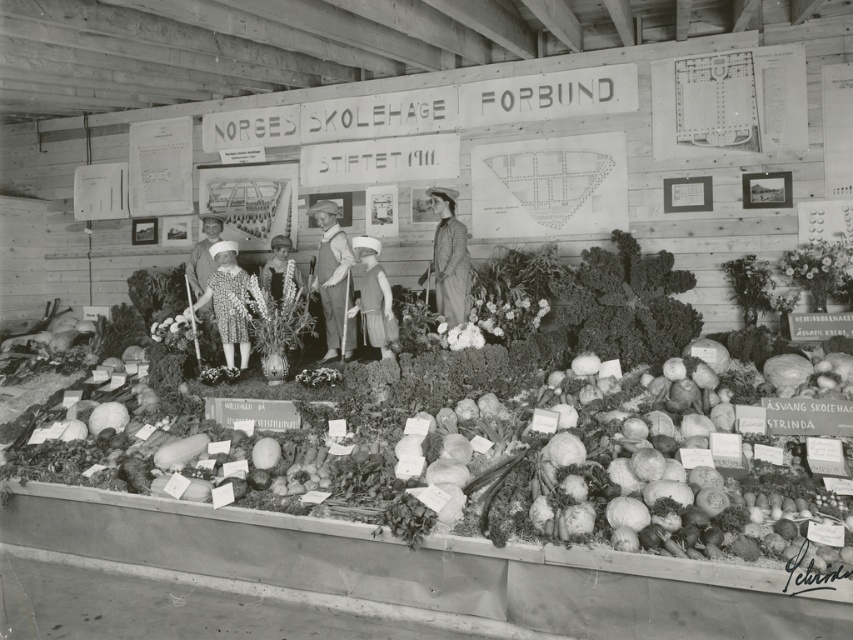
Question: Which point appears closest to the camera in this image?

Choices:
 (A) (381, 312)
 (B) (325, 321)
 (C) (268, 332)

Answer: (C)

Question: Which object is positioned farthest from the dress fabric at center?

Choices:
 (A) smooth green leaf at upper right
 (B) denim overalls at center
 (C) smooth wooden vase at right
 (D) matte brown dress at center

Answer: (C)

Question: Which object appears closest to the camera in this image?

Choices:
 (A) matte brown dress at center
 (B) matte brown coat at center
 (C) dress fabric at center
 (D) denim overalls at center

Answer: (A)

Question: Does smooth white vase at center appear on the right side of matte brown coat at center?

Choices:
 (A) no
 (B) yes

Answer: (A)

Question: Does dress fabric at center come behind smooth wooden vase at right?

Choices:
 (A) no
 (B) yes

Answer: (B)

Question: Can you confirm if smooth wooden vase at right is wider than smooth green leaf at upper right?

Choices:
 (A) no
 (B) yes

Answer: (B)